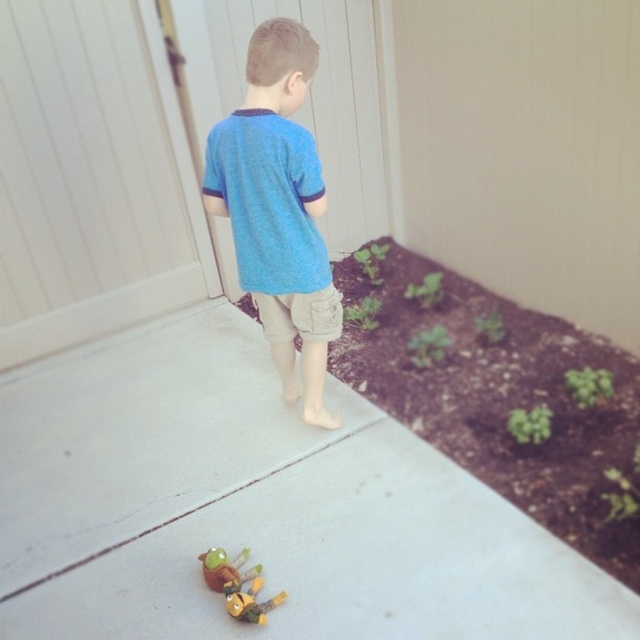
From the picture: The child is standing on a concrete surface near a garden bed. You notice a point at coordinates (278,209). What object is this point located on?

The point at coordinates (278,209) is located on the blue cotton shirt at center.

You are the child in the image. You want to pick up the toy that is near the garden bed. Which point, point (404, 449) or point (486, 472), is closer to the toy?

Point (486, 472) is closer to the toy because it is in front of point (404, 449).